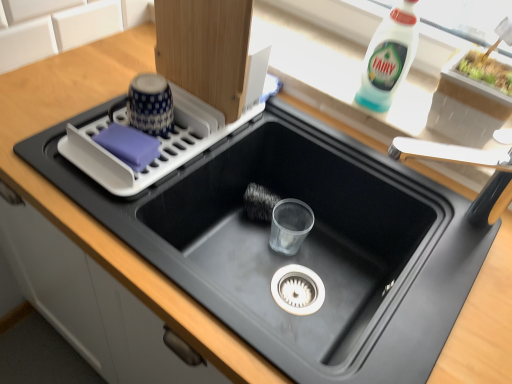
What is the approximate height of black matte sink at center?

black matte sink at center is 11.16 inches tall.

The width and height of the screenshot is (512, 384). What do you see at coordinates (159, 147) in the screenshot?
I see `white plastic dish rack at upper left` at bounding box center [159, 147].

Locate an element on the screen. Image resolution: width=512 pixels, height=384 pixels. white plastic faucet at upper right is located at coordinates click(466, 164).

Which is more to the left, white plastic faucet at upper right or black matte sink at center?

From the viewer's perspective, black matte sink at center appears more on the left side.

Are white plastic faucet at upper right and black matte sink at center beside each other?

No, white plastic faucet at upper right is not with black matte sink at center.

You are a GUI agent. You are given a task and a screenshot of the screen. Output one action in this format:
    pyautogui.click(x=<x>, y=<y>)
    Task: Click on the sink on the left of white plastic faucet at upper right
    This screenshot has width=512, height=384.
    Given the screenshot: What is the action you would take?
    pyautogui.click(x=300, y=248)

Consider the image. Is white plastic faucet at upper right far away from white plastic dish rack at upper left?

No, white plastic faucet at upper right is not far from white plastic dish rack at upper left.

Which is less distant, (x=391, y=156) or (x=183, y=101)?

Point (x=391, y=156).

Where is `appliance that appears below the white plastic faucet at upper right (from a real-world perspective)`? This screenshot has height=384, width=512. appliance that appears below the white plastic faucet at upper right (from a real-world perspective) is located at coordinates (159, 147).

Is white plastic dish rack at upper left facing towards white plastic bottle at upper right?

No, white plastic dish rack at upper left is not facing towards white plastic bottle at upper right.

Based on the photo, considering the positions of objects white plastic dish rack at upper left and white plastic bottle at upper right in the image provided, who is in front, white plastic dish rack at upper left or white plastic bottle at upper right?

Positioned in front is white plastic dish rack at upper left.

Which is farther, (81,140) or (384,80)?

Point (384,80)

From a real-world perspective, is white plastic faucet at upper right positioned under white plastic bottle at upper right based on gravity?

Correct, in the physical world, white plastic faucet at upper right is lower than white plastic bottle at upper right.

Where is `faucet that appears on the right of white plastic bottle at upper right`? This screenshot has width=512, height=384. faucet that appears on the right of white plastic bottle at upper right is located at coordinates (466, 164).

Looking at this image, could you tell me if white plastic faucet at upper right is turned towards white plastic bottle at upper right?

No, white plastic faucet at upper right is not aimed at white plastic bottle at upper right.

Is black matte sink at center not within white plastic faucet at upper right?

black matte sink at center lies outside white plastic faucet at upper right's area.

Which is more to the left, black matte sink at center or white plastic faucet at upper right?

black matte sink at center is more to the left.

From a real-world perspective, is black matte sink at center under white plastic faucet at upper right?

Yes, from a real-world perspective, black matte sink at center is under white plastic faucet at upper right.

Considering the relative sizes of black matte sink at center and white plastic faucet at upper right in the image provided, is black matte sink at center wider than white plastic faucet at upper right?

Yes, black matte sink at center is wider than white plastic faucet at upper right.

From a real-world perspective, is black matte sink at center above or below white plastic bottle at upper right?

Clearly, from a real-world perspective, black matte sink at center is below white plastic bottle at upper right.

Is black matte sink at center bigger or smaller than white plastic bottle at upper right?

Result: Clearly, black matte sink at center is larger in size than white plastic bottle at upper right.

Considering the relative sizes of black matte sink at center and white plastic bottle at upper right in the image provided, is black matte sink at center thinner than white plastic bottle at upper right?

Incorrect, the width of black matte sink at center is not less than that of white plastic bottle at upper right.

Is black matte sink at center inside or outside of white plastic dish rack at upper left?

black matte sink at center is outside white plastic dish rack at upper left.

Could you tell me if black matte sink at center is facing white plastic dish rack at upper left?

No, black matte sink at center is not turned towards white plastic dish rack at upper left.

From the picture: Which is more to the left, black matte sink at center or white plastic dish rack at upper left?

From the viewer's perspective, white plastic dish rack at upper left appears more on the left side.

From the image's perspective, which one is positioned lower, black matte sink at center or white plastic dish rack at upper left?

black matte sink at center is shown below in the image.

I want to click on sink below the white plastic faucet at upper right (from the image's perspective), so click(x=300, y=248).

Locate an element on the screen. The image size is (512, 384). faucet above the white plastic dish rack at upper left (from a real-world perspective) is located at coordinates (466, 164).

From the image, which object appears to be farther from white plastic bottle at upper right, white plastic faucet at upper right or black matte sink at center?

black matte sink at center is further to white plastic bottle at upper right.

Based on their spatial positions, is white plastic faucet at upper right or white plastic bottle at upper right further from black matte sink at center?

white plastic bottle at upper right.

Based on their spatial positions, is black matte sink at center or white plastic faucet at upper right further from white plastic bottle at upper right?

Among the two, black matte sink at center is located further to white plastic bottle at upper right.

Considering their positions, is black matte sink at center positioned closer to white plastic dish rack at upper left than white plastic bottle at upper right?

Based on the image, black matte sink at center appears to be nearer to white plastic dish rack at upper left.

Considering their positions, is black matte sink at center positioned closer to white plastic faucet at upper right than white plastic dish rack at upper left?

black matte sink at center.

From the image, which object appears to be farther from white plastic bottle at upper right, white plastic dish rack at upper left or black matte sink at center?

white plastic dish rack at upper left lies further to white plastic bottle at upper right than the other object.

Looking at the image, which one is located closer to white plastic faucet at upper right, white plastic bottle at upper right or black matte sink at center?

white plastic bottle at upper right is closer to white plastic faucet at upper right.

Considering their positions, is white plastic dish rack at upper left positioned closer to black matte sink at center than white plastic faucet at upper right?

white plastic dish rack at upper left lies closer to black matte sink at center than the other object.

Locate an element on the screen. This screenshot has height=384, width=512. bottle between black matte sink at center and white plastic faucet at upper right from left to right is located at coordinates (388, 58).

Locate an element on the screen. The height and width of the screenshot is (384, 512). sink between white plastic dish rack at upper left and white plastic bottle at upper right from left to right is located at coordinates (300, 248).

Where is `bottle between white plastic dish rack at upper left and white plastic faucet at upper right in the horizontal direction`? The width and height of the screenshot is (512, 384). bottle between white plastic dish rack at upper left and white plastic faucet at upper right in the horizontal direction is located at coordinates (388, 58).

The width and height of the screenshot is (512, 384). Find the location of `sink between white plastic dish rack at upper left and white plastic faucet at upper right in the horizontal direction`. sink between white plastic dish rack at upper left and white plastic faucet at upper right in the horizontal direction is located at coordinates (300, 248).